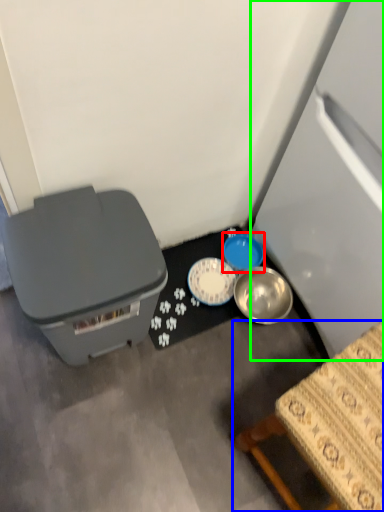
Question: Which is farther away from bowl (highlighted by a red box)? furniture (highlighted by a blue box) or refrigerator (highlighted by a green box)?

Choices:
 (A) furniture
 (B) refrigerator

Answer: (A)